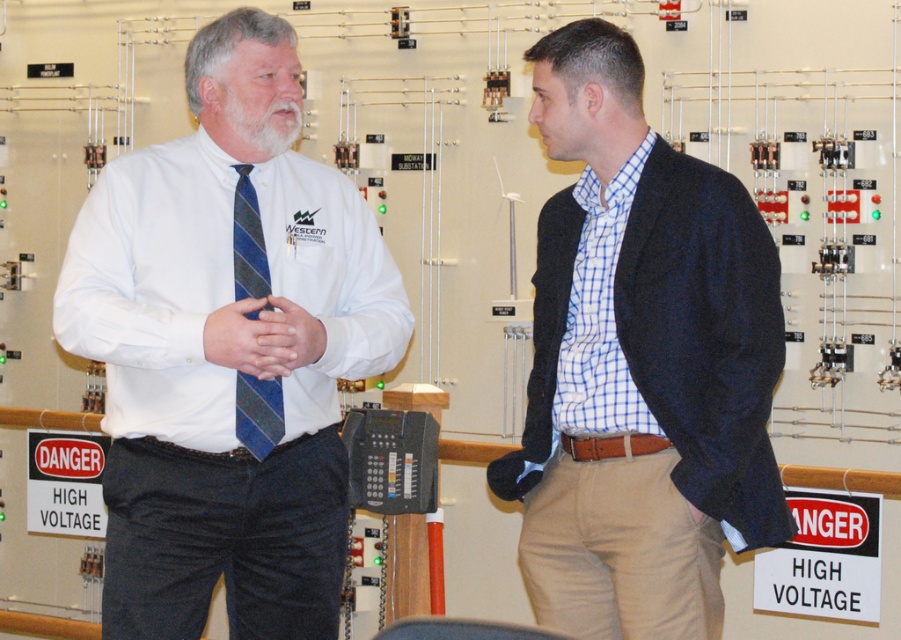
Question: Estimate the real-world distances between objects in this image. Which object is closer to the white shirt at center?

Choices:
 (A) blue striped tie at center
 (B) blue checkered shirt at center

Answer: (A)

Question: Does blue checkered shirt at center have a greater width compared to whitehairbeard at left?

Choices:
 (A) yes
 (B) no

Answer: (A)

Question: From the image, what is the correct spatial relationship of white shirt at center in relation to whitehairbeard at left?

Choices:
 (A) below
 (B) above

Answer: (A)

Question: Does blue checkered shirt at center appear over whitehairbeard at left?

Choices:
 (A) yes
 (B) no

Answer: (B)

Question: Which point appears closest to the camera in this image?

Choices:
 (A) (717, 266)
 (B) (275, 145)
 (C) (271, 442)

Answer: (A)

Question: Which point appears farthest from the camera in this image?

Choices:
 (A) (260, 102)
 (B) (633, 232)
 (C) (266, 116)
 (D) (251, 433)

Answer: (B)